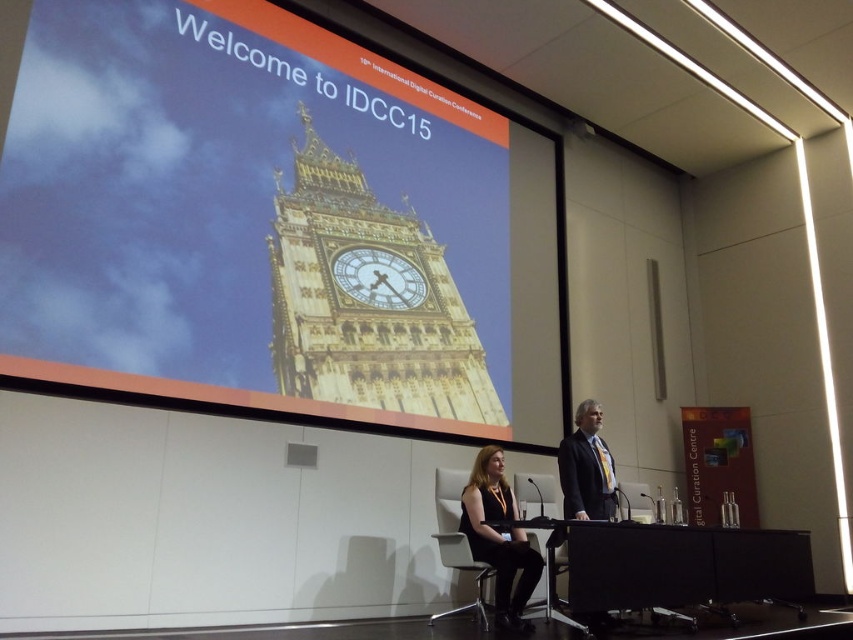
Between point (335, 324) and point (490, 516), which one is positioned behind?

The point (335, 324) is behind.

Is point (476, 362) closer to viewer compared to point (524, 561)?

No, (476, 362) is further to viewer.

Is point (326, 358) closer to camera compared to point (480, 528)?

No.

Locate an element on the screen. The width and height of the screenshot is (853, 640). gold/yellow stone big ben at center is located at coordinates (367, 298).

Who is shorter, gold metallic clock tower at upper center or gold/yellow stone big ben at center?

gold/yellow stone big ben at center

Describe the element at coordinates (259, 208) in the screenshot. The image size is (853, 640). I see `gold metallic clock tower at upper center` at that location.

Between point (372, 131) and point (401, 264), which one is positioned in front?

Point (401, 264)

Locate an element on the screen. The height and width of the screenshot is (640, 853). gold metallic clock tower at upper center is located at coordinates (259, 208).

Who is higher up, gold metallic clock tower at upper center or black fabric dress at center?

Positioned higher is gold metallic clock tower at upper center.

Does gold metallic clock tower at upper center appear under black fabric dress at center?

No.

Does point (94, 378) come behind point (506, 502)?

No, it is not.

You are a GUI agent. You are given a task and a screenshot of the screen. Output one action in this format:
    pyautogui.click(x=<x>, y=<y>)
    Task: Click on the gold metallic clock tower at upper center
    This screenshot has height=640, width=853.
    Given the screenshot: What is the action you would take?
    pyautogui.click(x=259, y=208)